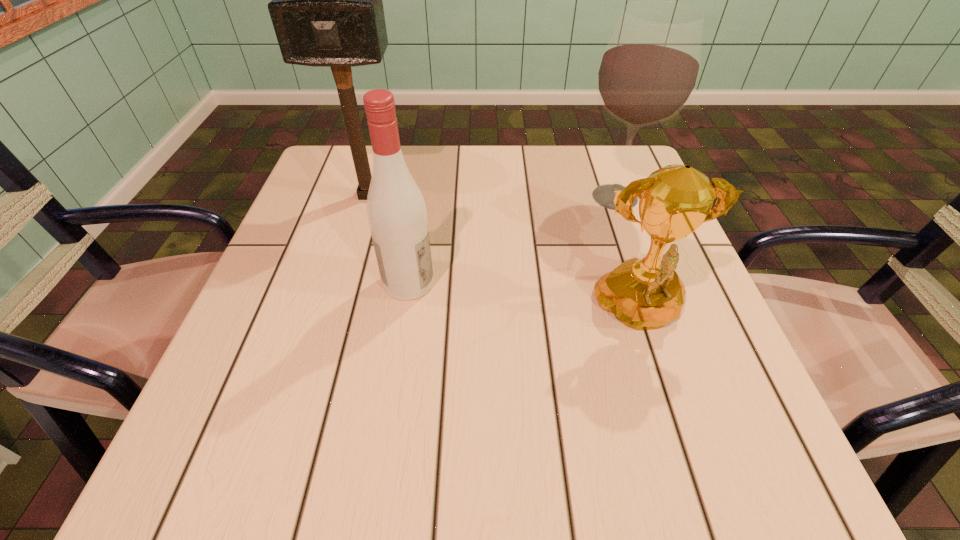
You are a GUI agent. You are given a task and a screenshot of the screen. Output one action in this format:
    pyautogui.click(x=<x>, y=<y>)
    Task: Click on the unoccupied position between the mallet and the award
    The image size is (960, 540).
    Given the screenshot: What is the action you would take?
    [504, 255]

At what (x,y) coordinates should I click in order to perform the action: click on vacant space that is in between the award and the left alcohol. Please return your answer as a coordinate pair (x, y). This screenshot has height=540, width=960. Looking at the image, I should click on coord(524,299).

Identify which object is located as the second nearest to the mallet. Please provide its 2D coordinates. Your answer should be formatted as a tuple, i.e. [(x, y)], where the tuple contains the x and y coordinates of a point satisfying the conditions above.

[(649, 70)]

Locate an element on the screen. object that is the nearest to the mallet is located at coordinates pyautogui.click(x=396, y=210).